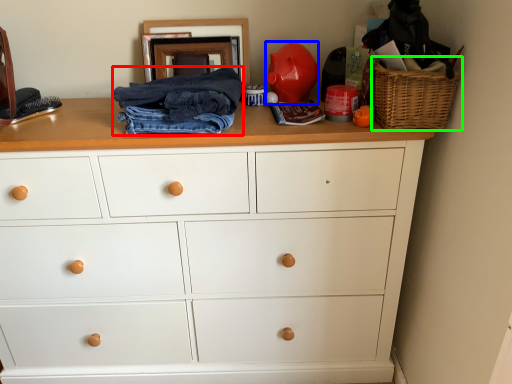
Question: Considering the real-world distances, which object is closest to clothing (highlighted by a red box)? toy (highlighted by a blue box) or basket (highlighted by a green box).

Choices:
 (A) toy
 (B) basket

Answer: (A)